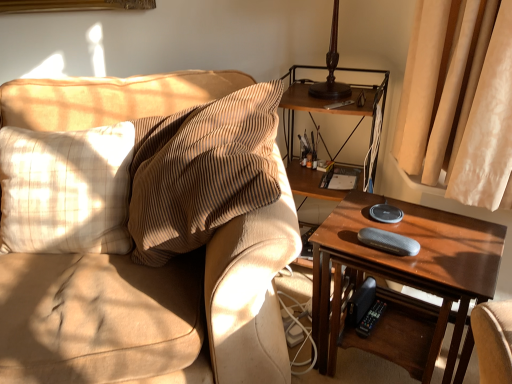
Describe the element at coordinates (153, 310) in the screenshot. This screenshot has width=512, height=384. I see `textured beige couch at left` at that location.

In the scene shown: In order to face beige plaid pillow at left, should I rotate leftwards or rightwards?

Turn left by 24.888 degrees to look at beige plaid pillow at left.

The width and height of the screenshot is (512, 384). Describe the element at coordinates (66, 190) in the screenshot. I see `beige plaid pillow at left` at that location.

Find the location of a particular element. wooden table at right is located at coordinates (409, 258).

The image size is (512, 384). Identify the location of textured beige couch at left. (153, 310).

Is the depth of wooden shelf at right less than that of beige plaid pillow at left?

No.

How different are the orientations of wooden shelf at right and beige plaid pillow at left in degrees?

The angle between the facing direction of wooden shelf at right and the facing direction of beige plaid pillow at left is 25.2 degrees.

Considering the sizes of objects wooden shelf at right and beige plaid pillow at left in the image provided, who is shorter, wooden shelf at right or beige plaid pillow at left?

beige plaid pillow at left is shorter.

From the picture: Is wooden shelf at right looking in the opposite direction of beige plaid pillow at left?

No, wooden shelf at right is not facing away from beige plaid pillow at left.

Is wooden shelf at right taller or shorter than textured beige couch at left?

In the image, wooden shelf at right appears to be taller than textured beige couch at left.

Does wooden shelf at right have a larger size compared to textured beige couch at left?

No.

From the image's perspective, between wooden shelf at right and textured beige couch at left, which one is located above?

textured beige couch at left, from the image's perspective.

Identify the location of table that appears on the right of wooden shelf at right. Image resolution: width=512 pixels, height=384 pixels. (409, 258).

Considering the relative positions of wooden table at right and wooden shelf at right in the image provided, is wooden table at right behind wooden shelf at right?

That is False.

Consider the image. Which object is wider, wooden table at right or wooden shelf at right?

With larger width is wooden table at right.

From the image's perspective, which is above, wooden table at right or wooden shelf at right?

From the image's view, wooden shelf at right is above.

Could you tell me if beige plaid pillow at left is turned towards wooden shelf at right?

No, beige plaid pillow at left is not turned towards wooden shelf at right.

Is beige plaid pillow at left further to camera compared to wooden shelf at right?

No, it is not.

Considering the points (123, 245) and (370, 108), which point is in front, point (123, 245) or point (370, 108)?

Point (123, 245)

Identify the location of shelf behind the beige plaid pillow at left. (318, 125).

Considering the sizes of objects wooden shelf at right and wooden table at right in the image provided, who is shorter, wooden shelf at right or wooden table at right?

Standing shorter between the two is wooden table at right.

Does point (359, 95) appear closer or farther from the camera than point (453, 268)?

Point (359, 95) appears to be farther away from the viewer than point (453, 268).

Is wooden shelf at right outside of wooden table at right?

Yes, wooden shelf at right is not within wooden table at right.

From a real-world perspective, is wooden shelf at right positioned above or below wooden table at right?

From a real-world perspective, wooden shelf at right is physically above wooden table at right.

Does textured beige couch at left appear on the right side of beige plaid pillow at left?

Yes.

How far apart are textured beige couch at left and beige plaid pillow at left?

textured beige couch at left is 24.32 centimeters from beige plaid pillow at left.

Which object is more forward, textured beige couch at left or beige plaid pillow at left?

Positioned in front is textured beige couch at left.

How different are the orientations of textured beige couch at left and beige plaid pillow at left in degrees?

59 degrees separate the facing orientations of textured beige couch at left and beige plaid pillow at left.

Which is less distant, (326, 329) or (112, 98)?

The point (326, 329) is closer.

From the image's perspective, which one is positioned lower, wooden table at right or textured beige couch at left?

From the image's view, wooden table at right is below.

Measure the distance between wooden table at right and textured beige couch at left.

wooden table at right is 43.25 centimeters away from textured beige couch at left.

Who is bigger, wooden table at right or textured beige couch at left?

textured beige couch at left is bigger.

Find the location of a particular element. The width and height of the screenshot is (512, 384). pillow below the wooden shelf at right (from the image's perspective) is located at coordinates (66, 190).

Find the location of a particular element. This screenshot has height=384, width=512. shelf located on the right of textured beige couch at left is located at coordinates (318, 125).

Considering their positions, is textured beige couch at left positioned further to beige plaid pillow at left than wooden shelf at right?

The object further to beige plaid pillow at left is wooden shelf at right.

From the image, which object appears to be farther from wooden table at right, beige plaid pillow at left or wooden shelf at right?

Based on the image, beige plaid pillow at left appears to be further to wooden table at right.

Which object lies nearer to the anchor point wooden table at right, wooden shelf at right or textured beige couch at left?

Among the two, wooden shelf at right is located nearer to wooden table at right.

From the image, which object appears to be nearer to textured beige couch at left, wooden shelf at right or wooden table at right?

Among the two, wooden table at right is located nearer to textured beige couch at left.

Based on their spatial positions, is wooden shelf at right or beige plaid pillow at left further from textured beige couch at left?

wooden shelf at right is further to textured beige couch at left.

When comparing their distances from wooden shelf at right, does beige plaid pillow at left or textured beige couch at left seem further?

Among the two, beige plaid pillow at left is located further to wooden shelf at right.

Based on their spatial positions, is wooden table at right or wooden shelf at right further from beige plaid pillow at left?

Based on the image, wooden table at right appears to be further to beige plaid pillow at left.

Based on their spatial positions, is textured beige couch at left or wooden shelf at right further from wooden table at right?

Among the two, textured beige couch at left is located further to wooden table at right.

Where is `studio couch between beige plaid pillow at left and wooden table at right from left to right`? This screenshot has width=512, height=384. studio couch between beige plaid pillow at left and wooden table at right from left to right is located at coordinates (153, 310).

The width and height of the screenshot is (512, 384). What are the coordinates of `shelf situated between beige plaid pillow at left and wooden table at right from left to right` in the screenshot? It's located at (318, 125).

This screenshot has height=384, width=512. I want to click on studio couch between beige plaid pillow at left and wooden shelf at right from left to right, so click(153, 310).

Locate an element on the screen. The width and height of the screenshot is (512, 384). shelf between textured beige couch at left and wooden table at right in the horizontal direction is located at coordinates (318, 125).